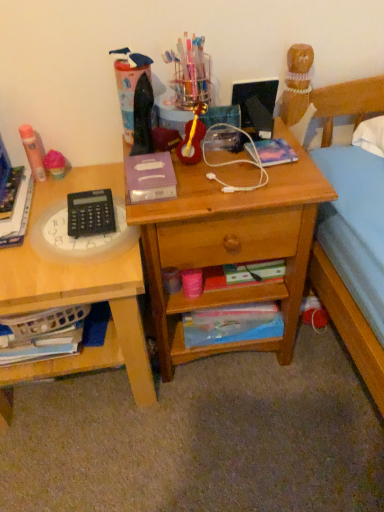
Identify the location of blank space above wooden desk at left (from a real-world perspective). (44, 222).